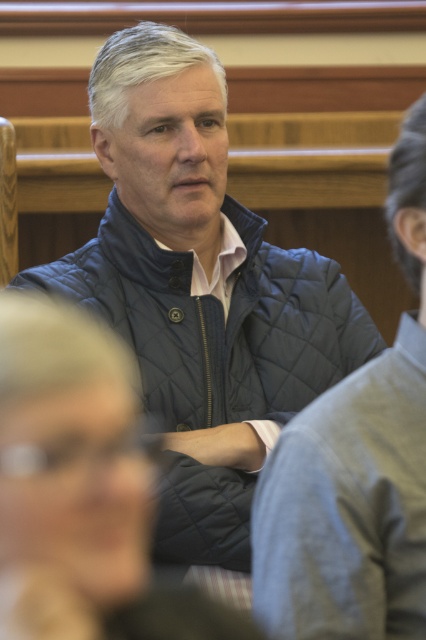
Question: Is quilted blue jacket at center to the right of quilted navy jacket at center from the viewer's perspective?

Choices:
 (A) no
 (B) yes

Answer: (A)

Question: Which of the following is the closest to the observer?

Choices:
 (A) quilted navy jacket at center
 (B) quilted blue jacket at center

Answer: (B)

Question: Does quilted blue jacket at center have a larger size compared to quilted navy jacket at center?

Choices:
 (A) no
 (B) yes

Answer: (A)

Question: Does quilted blue jacket at center have a larger size compared to quilted navy jacket at center?

Choices:
 (A) no
 (B) yes

Answer: (A)